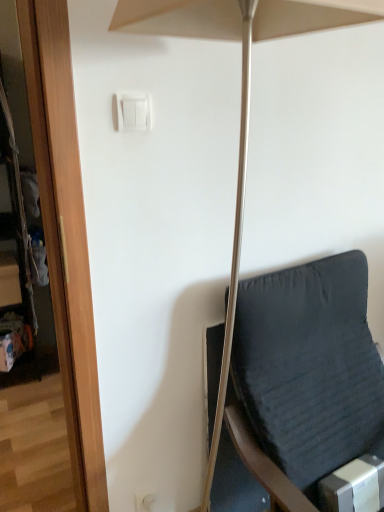
Question: Is white plastic light switch at upper center in front of or behind matte beige umbrella at center in the image?

Choices:
 (A) front
 (B) behind

Answer: (B)

Question: From the image's perspective, is white plastic light switch at upper center positioned above or below matte beige umbrella at center?

Choices:
 (A) below
 (B) above

Answer: (B)

Question: Estimate the real-world distances between objects in this image. Which object is closer to the dark fabric chair at right?

Choices:
 (A) white plastic light switch at upper center
 (B) matte beige umbrella at center

Answer: (B)

Question: Estimate the real-world distances between objects in this image. Which object is closer to the matte beige umbrella at center?

Choices:
 (A) white plastic light switch at upper center
 (B) dark fabric chair at right

Answer: (A)